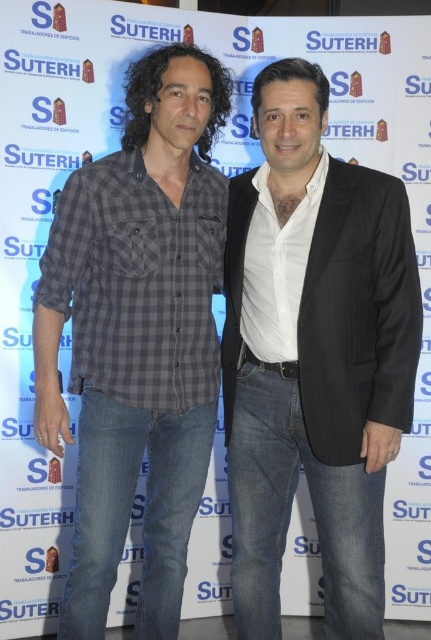
You are a photographer setting up for a group photo. You need to ensure that the two shirts, the white smooth shirt at center and the gray checkered shirt at center, are visible in the frame. Given that your camera has a minimum focus distance of 12 inches, will the current spacing between them allow both shirts to be in focus?

The distance between the white smooth shirt at center and the gray checkered shirt at center is 12.81 inches. Since this exceeds the camera minimum focus distance of 12 inches, both shirts will be in focus.

You are a photographer adjusting the focus on your camera. You want to capture a clear image of the white smooth shirt at center. Considering the distance, will the shirt be in focus if your camera has a depth of field that can sharply capture objects up to 1.8 meters away?

The white smooth shirt at center is 1.78 meters away from the camera, which is within the camera s depth of field range of up to 1.8 meters. Therefore, the shirt will be in focus.